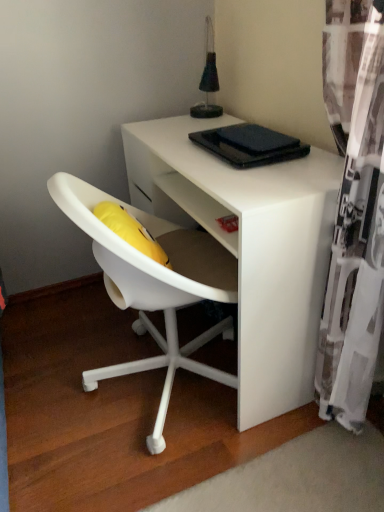
Question: Should I look upward or downward to see white matte desk at center?

Choices:
 (A) down
 (B) up

Answer: (B)

Question: Is black matte pad at upper center to the right of white matte desk at center from the viewer's perspective?

Choices:
 (A) no
 (B) yes

Answer: (B)

Question: Is black matte pad at upper center shorter than white matte desk at center?

Choices:
 (A) yes
 (B) no

Answer: (A)

Question: From a real-world perspective, is black matte pad at upper center physically below white matte desk at center?

Choices:
 (A) no
 (B) yes

Answer: (A)

Question: Is black matte pad at upper center directly adjacent to white matte desk at center?

Choices:
 (A) no
 (B) yes

Answer: (A)

Question: From a real-world perspective, is black matte pad at upper center on top of white matte desk at center?

Choices:
 (A) yes
 (B) no

Answer: (A)

Question: Considering the relative positions of black matte pad at upper center and white matte desk at center in the image provided, is black matte pad at upper center to the left of white matte desk at center from the viewer's perspective?

Choices:
 (A) yes
 (B) no

Answer: (B)

Question: From the image's perspective, would you say white sheer curtain at right is shown under black matte pad at upper center?

Choices:
 (A) no
 (B) yes

Answer: (B)

Question: Does white sheer curtain at right have a greater height compared to black matte pad at upper center?

Choices:
 (A) yes
 (B) no

Answer: (A)

Question: Is white sheer curtain at right oriented away from black matte pad at upper center?

Choices:
 (A) no
 (B) yes

Answer: (A)

Question: Does white sheer curtain at right have a lesser width compared to black matte pad at upper center?

Choices:
 (A) no
 (B) yes

Answer: (A)

Question: Can you confirm if white sheer curtain at right is smaller than black matte pad at upper center?

Choices:
 (A) yes
 (B) no

Answer: (B)

Question: Would you say white sheer curtain at right is outside black matte pad at upper center?

Choices:
 (A) yes
 (B) no

Answer: (A)

Question: From the image's perspective, does white sheer curtain at right appear higher than white matte desk at center?

Choices:
 (A) yes
 (B) no

Answer: (B)